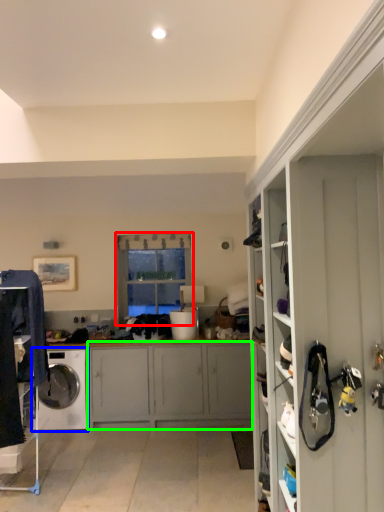
Question: Which is farther away from window (highlighted by a red box)? washing machine (highlighted by a blue box) or cabinetry (highlighted by a green box)?

Choices:
 (A) washing machine
 (B) cabinetry

Answer: (A)